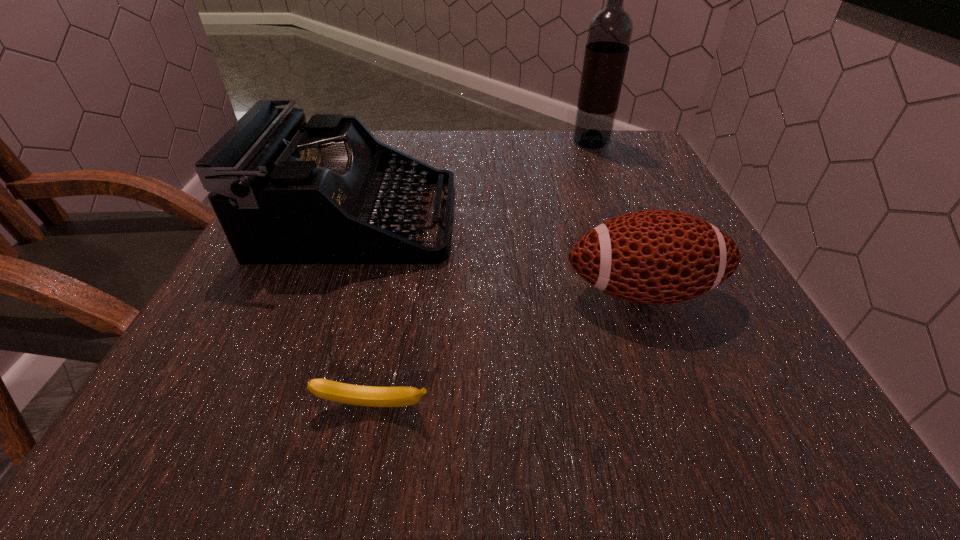
I want to click on free space that is in between the football and the typewriter, so click(500, 255).

Find the location of a particular element. The height and width of the screenshot is (540, 960). free area in between the nearest object and the typewriter is located at coordinates tap(366, 313).

At what (x,y) coordinates should I click in order to perform the action: click on free point between the wine bottle and the typewriter. Please return your answer as a coordinate pair (x, y). Looking at the image, I should click on (474, 181).

Select which object is the second closest to the second tallest object. Please provide its 2D coordinates. Your answer should be formatted as a tuple, i.e. [(x, y)], where the tuple contains the x and y coordinates of a point satisfying the conditions above.

[(373, 396)]

Image resolution: width=960 pixels, height=540 pixels. Find the location of `object that stands as the third closest to the football`. object that stands as the third closest to the football is located at coordinates [610, 31].

Where is `free space that satisfies the following two spatial constraints: 1. on the back side of the football; 2. on the left side of the farthest object`? The height and width of the screenshot is (540, 960). free space that satisfies the following two spatial constraints: 1. on the back side of the football; 2. on the left side of the farthest object is located at coordinates 585,143.

Find the location of a particular element. vacant region that satisfies the following two spatial constraints: 1. on the typing side of the typewriter; 2. on the back side of the football is located at coordinates (332, 292).